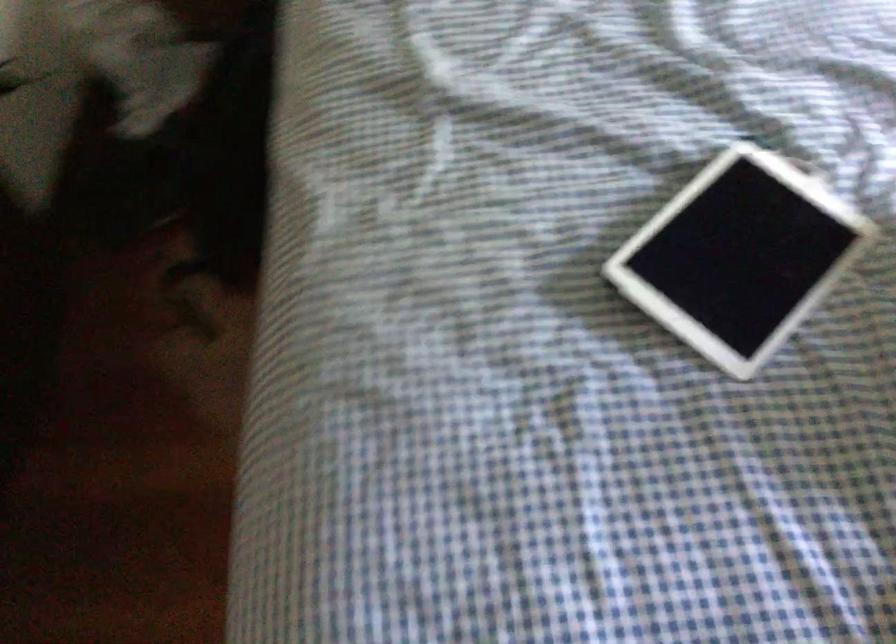
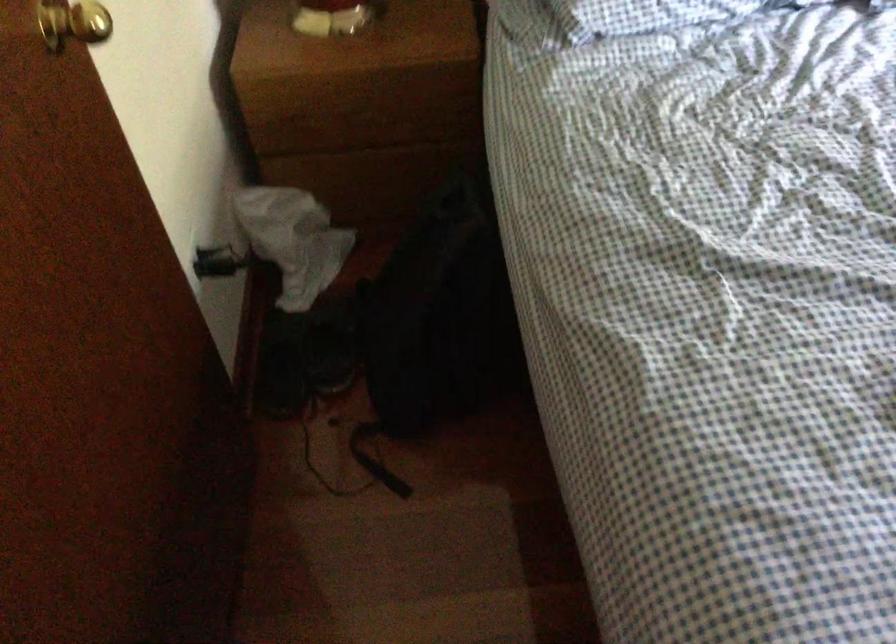
In the second image, find the point that corresponds to pixel 162 176 in the first image.

(332, 345)